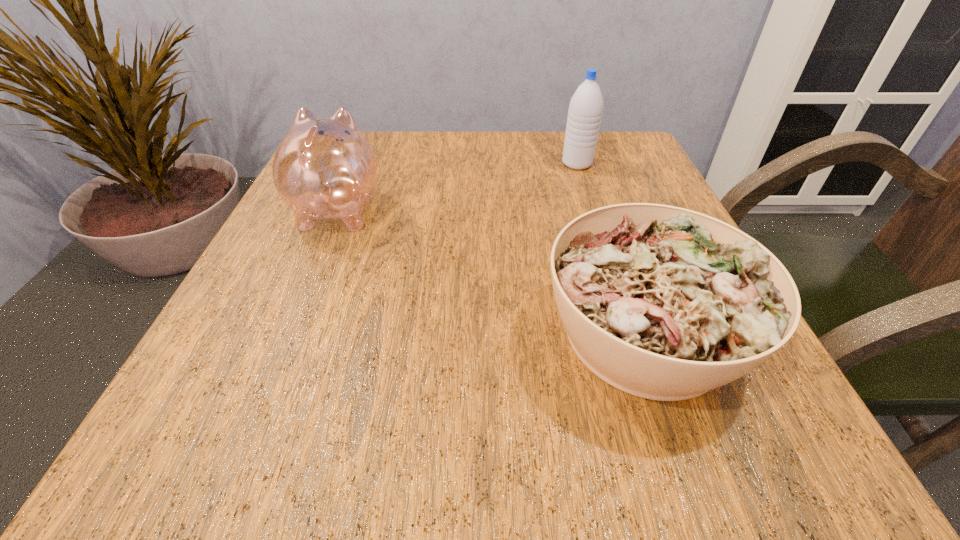
Find the location of `the farthest object`. the farthest object is located at coordinates (585, 110).

Locate an element on the screen. This screenshot has width=960, height=540. the leftmost object is located at coordinates (324, 168).

Locate an element on the screen. The image size is (960, 540). the second farthest object is located at coordinates (324, 168).

This screenshot has width=960, height=540. Identify the location of the shortest object. (664, 303).

The width and height of the screenshot is (960, 540). What are the coordinates of `salad` in the screenshot? It's located at (664, 303).

Locate an element on the screen. vacant space situated on the left of the farthest object is located at coordinates (526, 164).

The width and height of the screenshot is (960, 540). Find the location of `free space located on the front facing side of the leftmost object`. free space located on the front facing side of the leftmost object is located at coordinates (366, 143).

Identify the location of vacant space located on the front facing side of the leftmost object. (356, 165).

At what (x,y) coordinates should I click in order to perform the action: click on vacant region located 0.100m on the left of the nearest object. Please return your answer as a coordinate pair (x, y). Looking at the image, I should click on (472, 333).

Where is `water bottle located in the far edge section of the desktop`? The image size is (960, 540). water bottle located in the far edge section of the desktop is located at coordinates (585, 110).